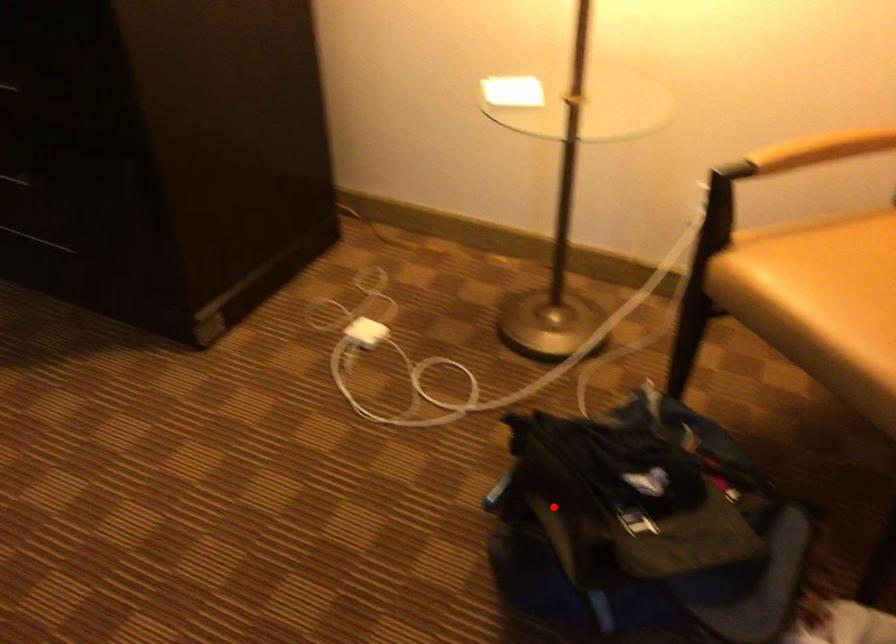
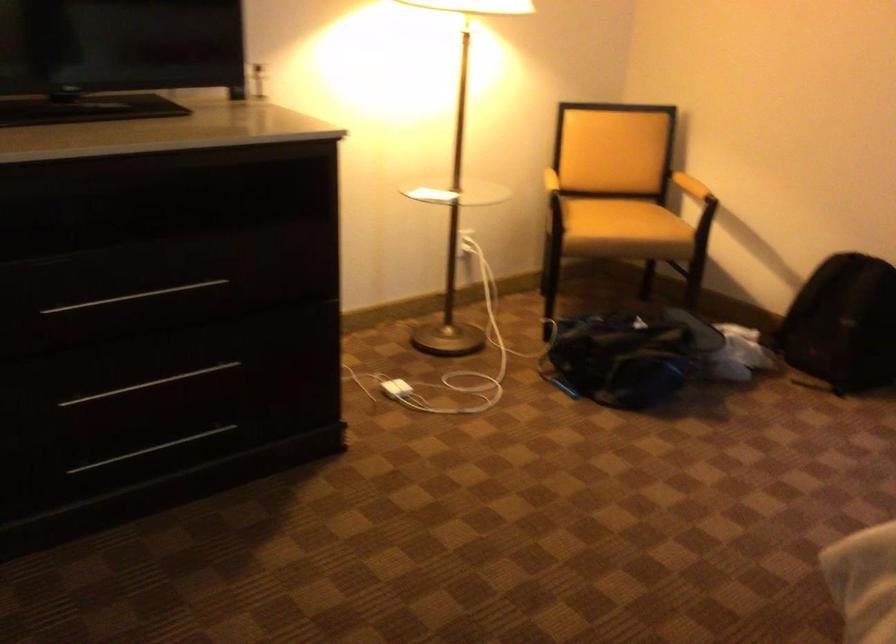
Question: I am providing you with two images of the same scene from different viewpoints. A red point is marked on the first image. Is the red point's position out of view in image 2?

Choices:
 (A) Yes
 (B) No

Answer: (B)